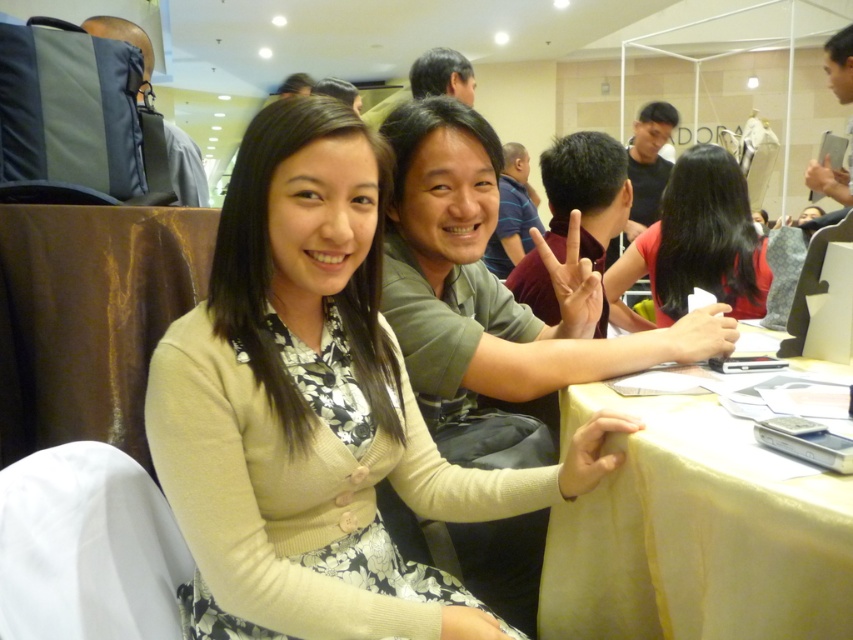
You are a photographer at this event and need to place a small vase on the yellow fabric table at lower right so that it doesn t block the view of the red matte shirt at center. Is the table tall enough to ensure the vase won t hide the shirt?

The yellow fabric table at lower right is not as tall as the red matte shirt at center, so placing the vase there might block the view of the shirt since the table is shorter than the shirt.